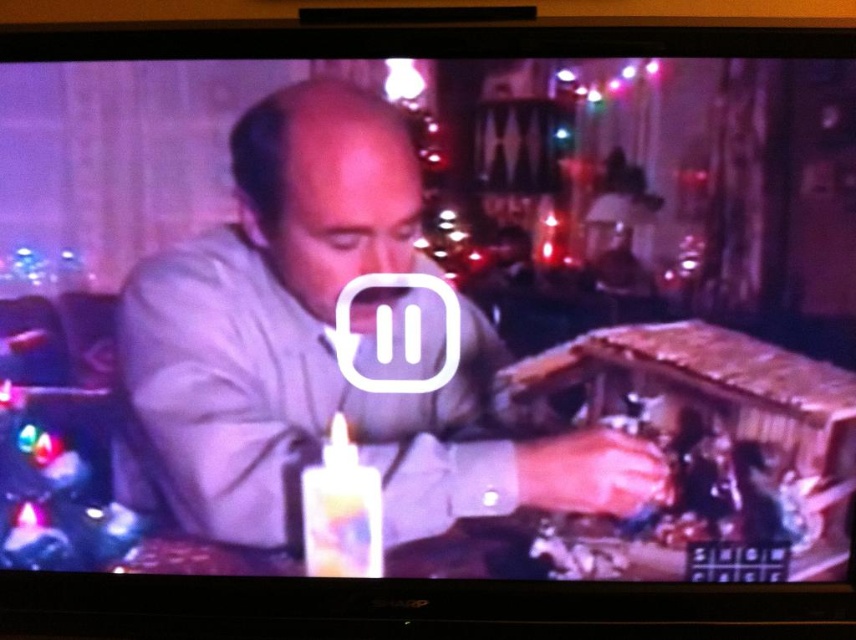
Question: Does matte gray shirt at center appear under white glossy birthday candle at lower center?

Choices:
 (A) no
 (B) yes

Answer: (A)

Question: Can you confirm if matte gray shirt at center is positioned below white glossy birthday candle at lower center?

Choices:
 (A) yes
 (B) no

Answer: (B)

Question: Which object is closer to the camera taking this photo?

Choices:
 (A) white glossy birthday candle at lower center
 (B) matte gray shirt at center

Answer: (B)

Question: Is matte gray shirt at center above white glossy birthday candle at lower center?

Choices:
 (A) no
 (B) yes

Answer: (B)

Question: Which point is farther to the camera?

Choices:
 (A) white glossy birthday candle at lower center
 (B) matte gray shirt at center

Answer: (A)

Question: Among these points, which one is farthest from the camera?

Choices:
 (A) [x=355, y=570]
 (B) [x=482, y=332]

Answer: (A)